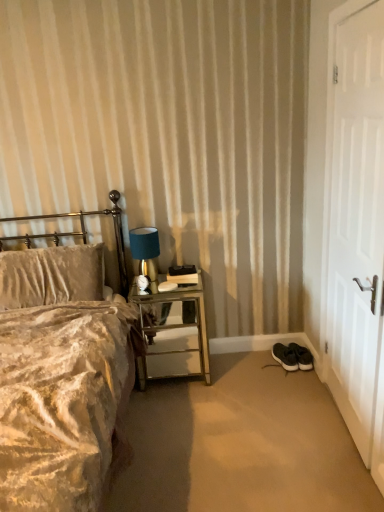
Question: Are white matte door at right and mirrored glass nightstand at center making contact?

Choices:
 (A) yes
 (B) no

Answer: (B)

Question: Can you confirm if white matte door at right is bigger than mirrored glass nightstand at center?

Choices:
 (A) no
 (B) yes

Answer: (A)

Question: Considering the relative sizes of white matte door at right and mirrored glass nightstand at center in the image provided, is white matte door at right shorter than mirrored glass nightstand at center?

Choices:
 (A) no
 (B) yes

Answer: (A)

Question: Does white matte door at right lie behind mirrored glass nightstand at center?

Choices:
 (A) yes
 (B) no

Answer: (B)

Question: Is mirrored glass nightstand at center surrounded by white matte door at right?

Choices:
 (A) no
 (B) yes

Answer: (A)

Question: Considering the positions of metallic gold headboard at left and black suede sneakers at lower right, placed as the 1th footwear when sorted from right to left, in the image, is metallic gold headboard at left wider or thinner than black suede sneakers at lower right, placed as the 1th footwear when sorted from right to left,?

Choices:
 (A) thin
 (B) wide

Answer: (A)

Question: From the image's perspective, is metallic gold headboard at left located above or below black suede sneakers at lower right, which is the 2th footwear from left to right?

Choices:
 (A) above
 (B) below

Answer: (A)

Question: Is metallic gold headboard at left to the left or to the right of black suede sneakers at lower right, which is the 2th footwear from left to right, in the image?

Choices:
 (A) left
 (B) right

Answer: (A)

Question: Is metallic gold headboard at left in front of or behind black suede sneakers at lower right, which is the 2th footwear from left to right, in the image?

Choices:
 (A) behind
 (B) front

Answer: (B)

Question: Is white matte door at right bigger or smaller than metallic gold headboard at left?

Choices:
 (A) big
 (B) small

Answer: (B)

Question: Considering their positions, is white matte door at right located in front of or behind metallic gold headboard at left?

Choices:
 (A) behind
 (B) front

Answer: (B)

Question: Choose the correct answer: Is white matte door at right inside metallic gold headboard at left or outside it?

Choices:
 (A) inside
 (B) outside

Answer: (B)

Question: Does point (360, 258) appear closer or farther from the camera than point (56, 244)?

Choices:
 (A) farther
 (B) closer

Answer: (B)

Question: Is point (3, 221) positioned closer to the camera than point (140, 254)?

Choices:
 (A) closer
 (B) farther

Answer: (B)

Question: Looking at their shapes, would you say metallic gold headboard at left is wider or thinner than satin blue lampshade at upper right?

Choices:
 (A) thin
 (B) wide

Answer: (B)